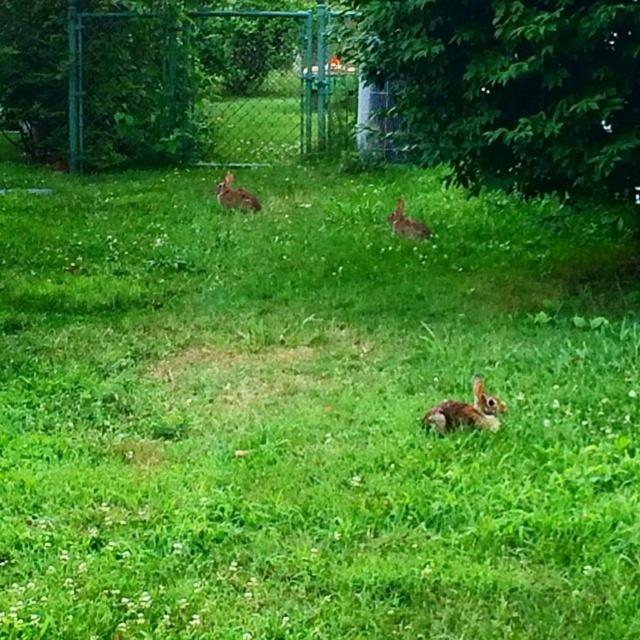
Does brown furry rabbit at lower center appear on the left side of brown furry rabbit at center?

In fact, brown furry rabbit at lower center is to the right of brown furry rabbit at center.

You are a GUI agent. You are given a task and a screenshot of the screen. Output one action in this format:
    pyautogui.click(x=<x>, y=<y>)
    Task: Click on the brown furry rabbit at lower center
    
    Given the screenshot: What is the action you would take?
    pyautogui.click(x=465, y=412)

Can you confirm if green chain-link fence at upper center is positioned to the left of brown furry rabbit at center?

Indeed, green chain-link fence at upper center is positioned on the left side of brown furry rabbit at center.

Which is in front, point (70, 141) or point (390, 227)?

Positioned in front is point (390, 227).

Identify the location of green chain-link fence at upper center. 204,84.

Is point (81, 26) positioned in front of point (486, 406)?

No, it is not.

In the scene shown: Which is more to the left, green chain-link fence at upper center or brown furry rabbit at lower center?

green chain-link fence at upper center is more to the left.

Which is in front, point (140, 17) or point (486, 392)?

Positioned in front is point (486, 392).

The width and height of the screenshot is (640, 640). Identify the location of green chain-link fence at upper center. (204, 84).